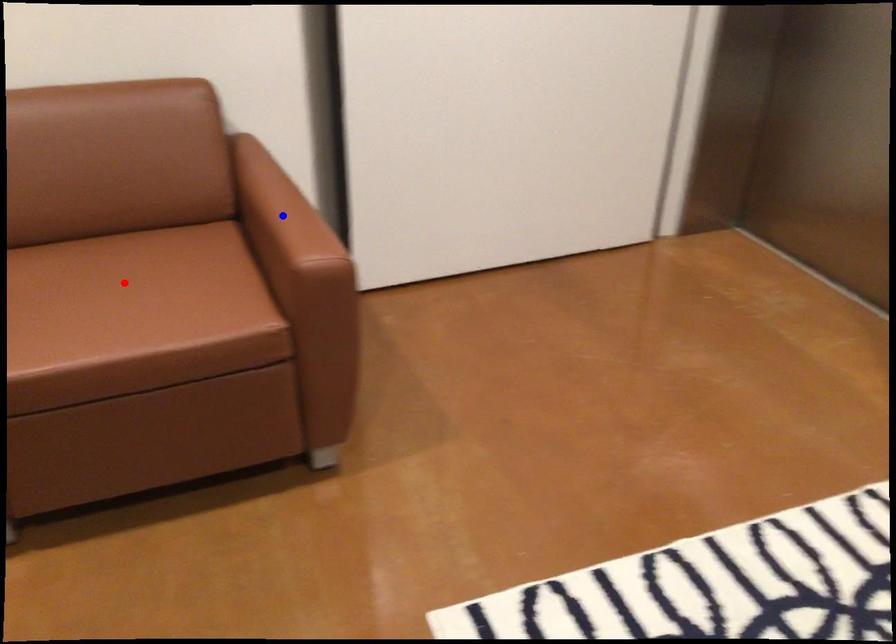
Question: Two points are marked on the image. Which point is closer to the camera?

Choices:
 (A) Blue point is closer.
 (B) Red point is closer.

Answer: (B)